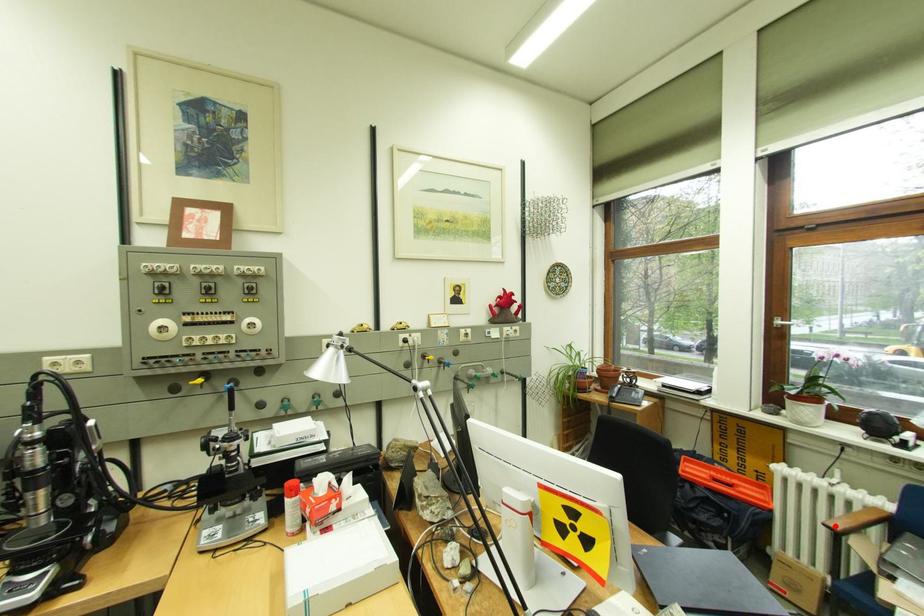
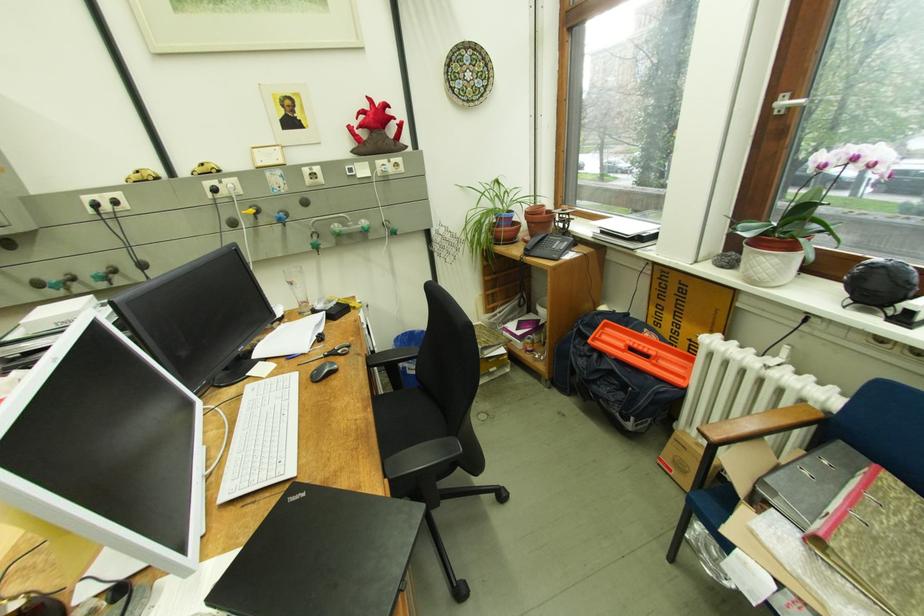
The point at the highlighted location is marked in the first image. Where is the corresponding point in the second image?

(709, 432)